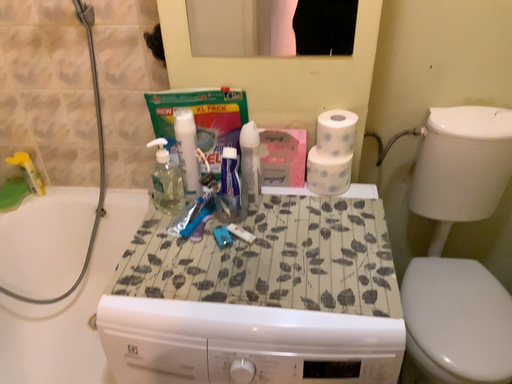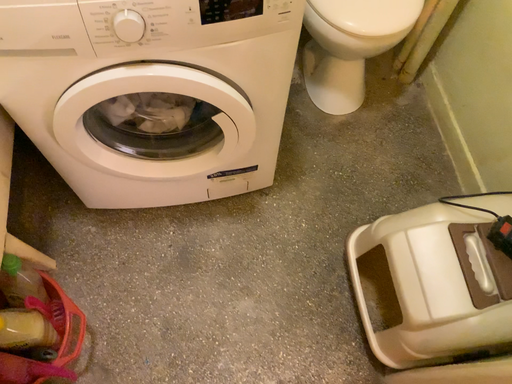
Question: Which way did the camera rotate in the video?

Choices:
 (A) rotated upward
 (B) rotated downward

Answer: (B)